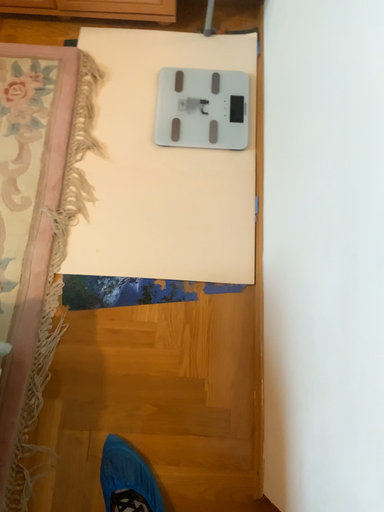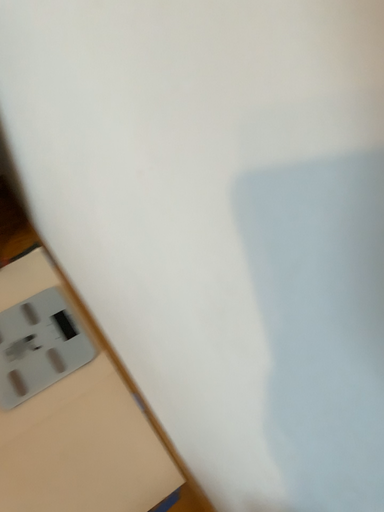
Question: Which way did the camera rotate in the video?

Choices:
 (A) rotated upward
 (B) rotated downward

Answer: (A)